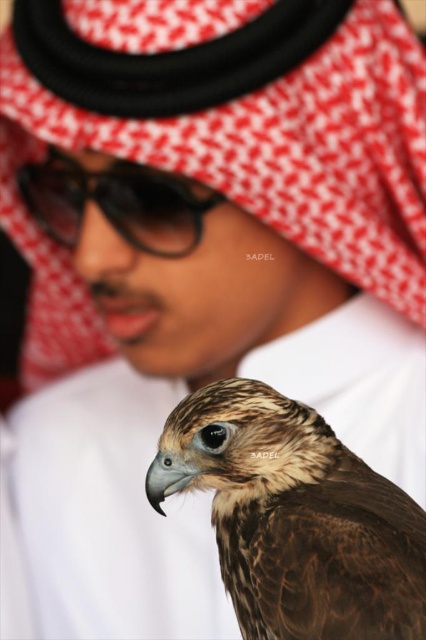
You are a photographer trying to capture a clear shot of both the brown feathered falcon at lower right and the black plastic goggles at upper center. Which object will appear larger in your photo?

The brown feathered falcon at lower right will appear larger in the photo because it is closer to the viewer than the black plastic goggles at upper center.

Based on the coordinates provided, which object is located at point (294, 516)?

The point (294, 516) marks the location of the brown feathered falcon at lower right.